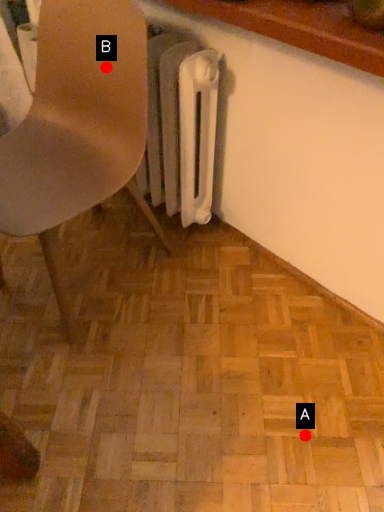
Question: Two points are circled on the image, labeled by A and B beside each circle. Which point is further to the camera?

Choices:
 (A) A is further
 (B) B is further

Answer: (B)